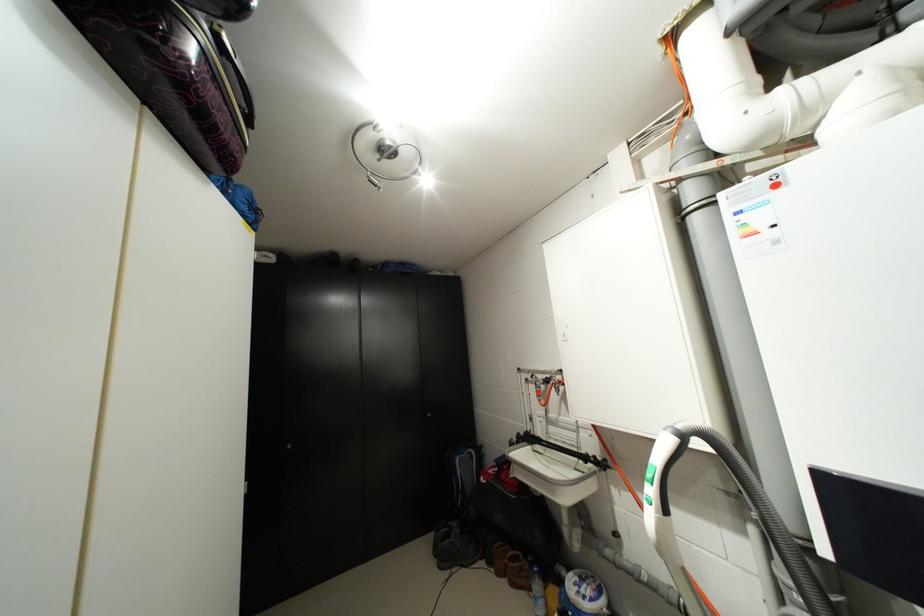
You are a GUI agent. You are given a task and a screenshot of the screen. Output one action in this format:
    pyautogui.click(x=<x>, y=<y>)
    Task: Click on the faucet handle
    The image size is (924, 616).
    Given the screenshot: What is the action you would take?
    pyautogui.click(x=546, y=392)